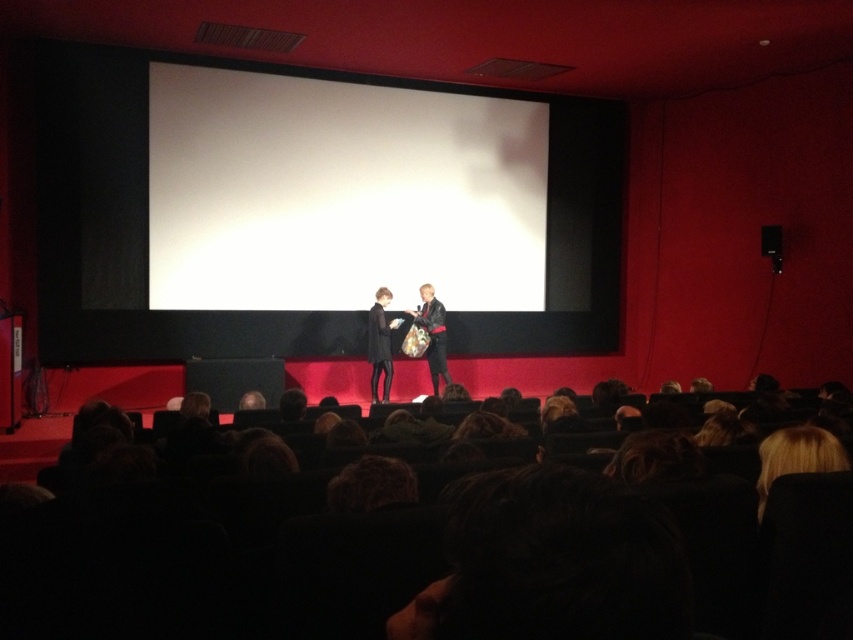
Question: Which point is farther to the camera?

Choices:
 (A) black leather jacket at center
 (B) leather jacket at center

Answer: (B)

Question: Observing the image, what is the correct spatial positioning of black leather jacket at center in reference to black plastic speaker at upper right?

Choices:
 (A) below
 (B) above

Answer: (A)

Question: Which point is farther to the camera?

Choices:
 (A) leather jacket at center
 (B) black leather jacket at center
 (C) black plastic speaker at upper right

Answer: (C)

Question: Which point is closer to the camera taking this photo?

Choices:
 (A) (776, 250)
 (B) (392, 298)
 (C) (434, 340)

Answer: (B)

Question: Does black leather jacket at center have a larger size compared to black plastic speaker at upper right?

Choices:
 (A) no
 (B) yes

Answer: (B)

Question: Can you confirm if black leather jacket at center is wider than leather jacket at center?

Choices:
 (A) yes
 (B) no

Answer: (B)